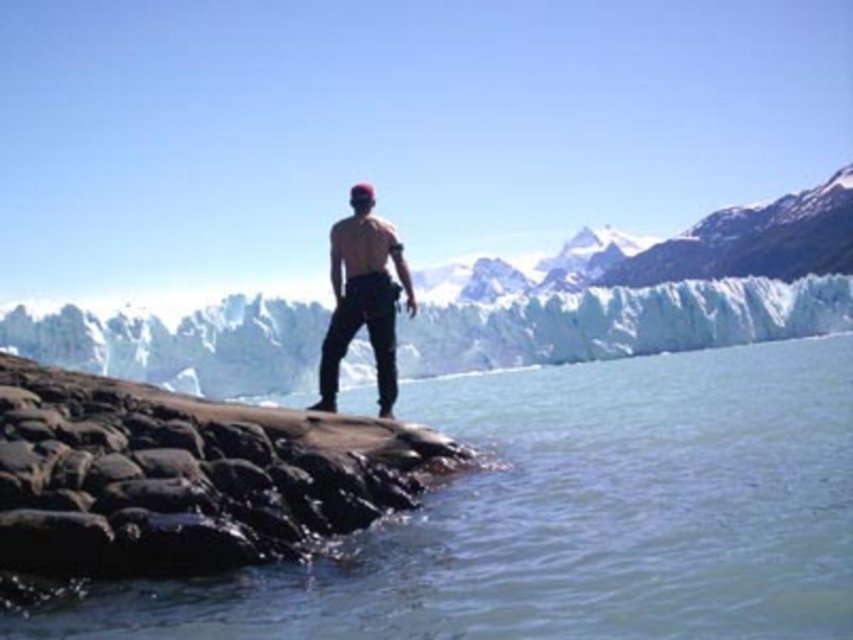
You are the person in the image standing on the rocky outcrop. You notice two points in the water ahead of you. One is at coordinates point (244, 440) and the other is at point (329, 236). Which point is closer to you?

Point (244, 440) is in front of point (329, 236), so the point (244, 440) is closer to you.

You are planning to cross the water to reach the snowy ice glacier at upper center. The rough textured rock at center is in your path. Considering their sizes, which object would you need to avoid stepping on to prevent slipping into the water?

The rough textured rock at center has a smaller width than the snowy ice glacier at upper center. To prevent slipping into the water, you should avoid stepping on the rough textured rock at center since it is narrower and less stable compared to the larger snowy ice glacier at upper center.

You are a hiker planning to walk from the snowy ice glacier at upper center to the matte black pants at center. Given that your average walking pace is 3 km per hour, how long would it take you to reach the destination?

The distance between the snowy ice glacier at upper center and the matte black pants at center is 233.28 meters. Converting meters to kilometers, that is 0.23328 km. Dividing the distance by your walking speed of 3 km per hour gives approximately 0.07776 hours. Multiplying this by 60 minutes yields roughly 4.6656 minutes. Therefore, it would take about 4.7 minutes to reach the destination.